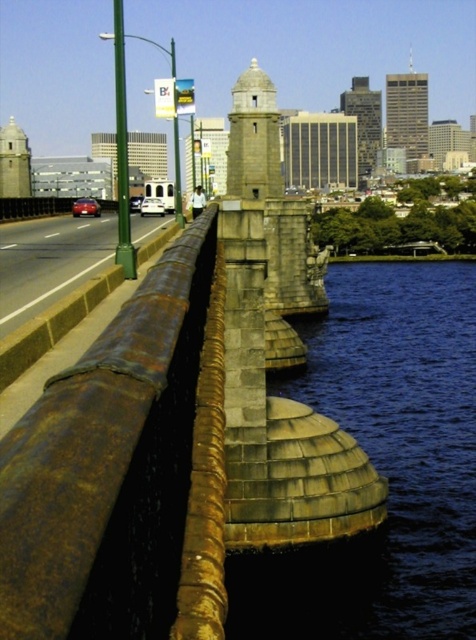
You are standing on the bridge and looking at the gold textured skyscraper at upper center. If you want to take a photo of it with your phone, which has a maximum zoom range of 5x, would the skyscraper appear blurry due to distance?

The gold textured skyscraper at upper center is 674.74 meters away. Since most phone cameras struggle to maintain clarity beyond 100 meters even with digital zoom, the skyscraper would likely appear blurry when zoomed in to 5x.

You are a city planner assessing the distance between two landmarks for a new pedestrian walkway. The walkway must be at least 500 meters long to accommodate safety features. Given the image, will the distance between the rustic stone bell tower at center and the rustic stone tower at upper center suffice for the walkway?

The distance between the rustic stone bell tower at center and the rustic stone tower at upper center is 487.14 meters, which is less than the required 500 meters. Therefore, the proposed pedestrian walkway would not be long enough to meet safety standards.

You are standing on the bridge looking towards the city. You see a point at coordinate (279, 168) and another at (408, 83). Which point is closer to you?

Point (279, 168) is closer to you because it is in front of point (408, 83).